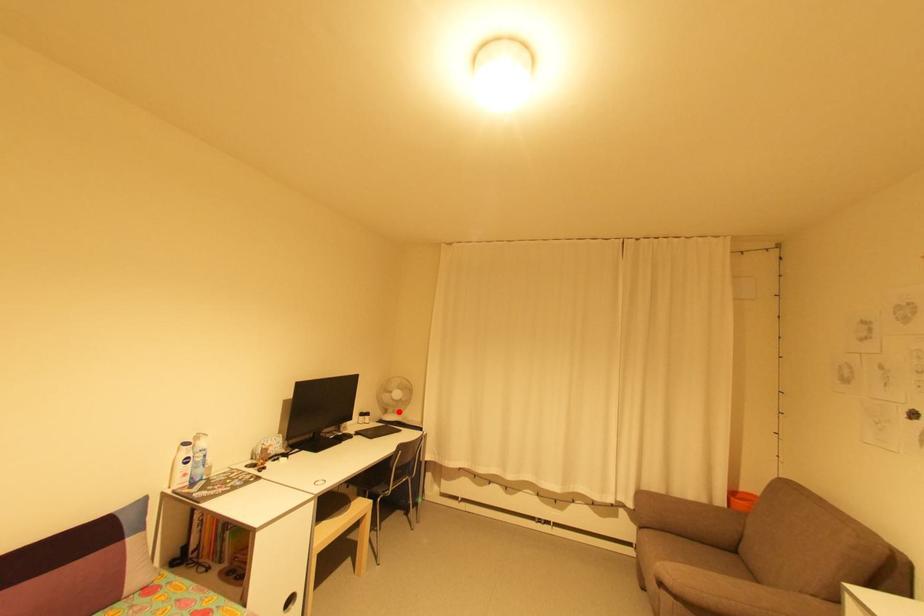
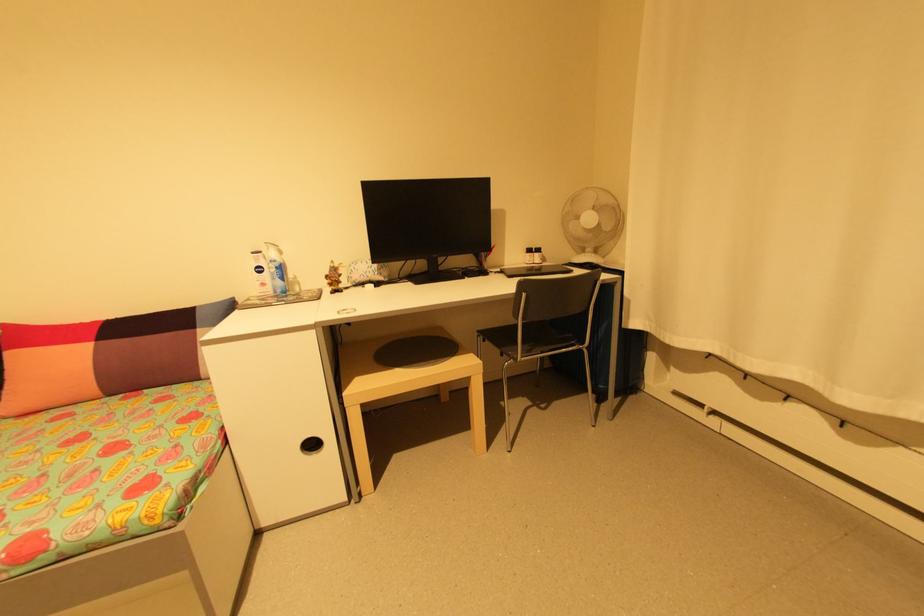
Where in the second image is the point corresponding to the highlighted location from the first image?

(600, 252)